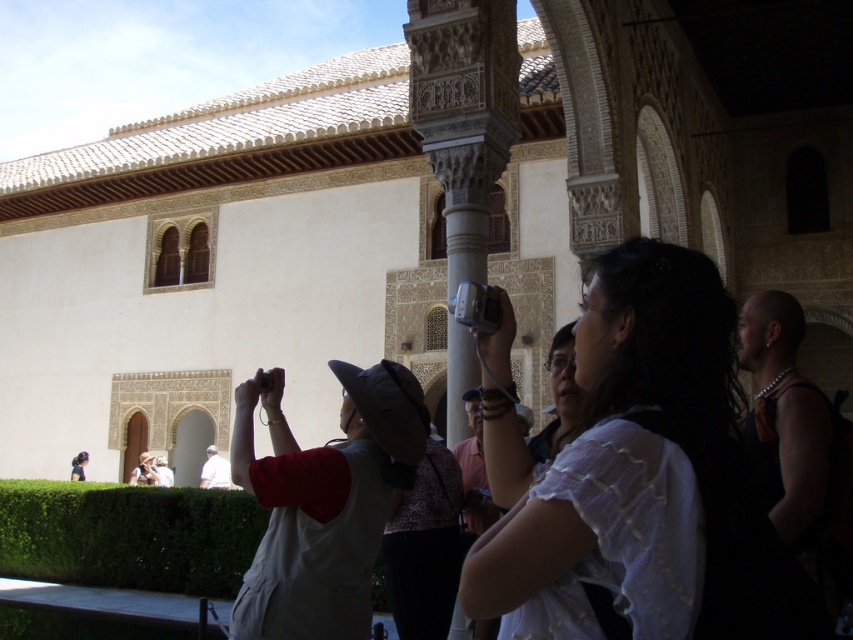
Who is shorter, white cotton shirt at center or light brown straw hat at center?

light brown straw hat at center is shorter.

Is point (425, 504) in front of point (149, 481)?

Yes, point (425, 504) is closer to viewer.

Find the location of a particular element. This screenshot has width=853, height=640. white cotton shirt at center is located at coordinates (425, 547).

Who is positioned more to the left, white lace shirt at center or white cotton shirt at center?

white cotton shirt at center is more to the left.

Can you confirm if white lace shirt at center is taller than white cotton shirt at center?

Yes.

Where is `white lace shirt at center`? The width and height of the screenshot is (853, 640). white lace shirt at center is located at coordinates (628, 448).

Image resolution: width=853 pixels, height=640 pixels. Find the location of `white lace shirt at center`. white lace shirt at center is located at coordinates (628, 448).

The width and height of the screenshot is (853, 640). I want to click on black leather backpack at right, so click(790, 433).

Can you confirm if black leather backpack at right is taller than matte white shirt at center?

Yes, black leather backpack at right is taller than matte white shirt at center.

Is point (761, 376) less distant than point (76, 472)?

Yes, point (761, 376) is closer to viewer.

Locate an element on the screen. This screenshot has width=853, height=640. black leather backpack at right is located at coordinates (790, 433).